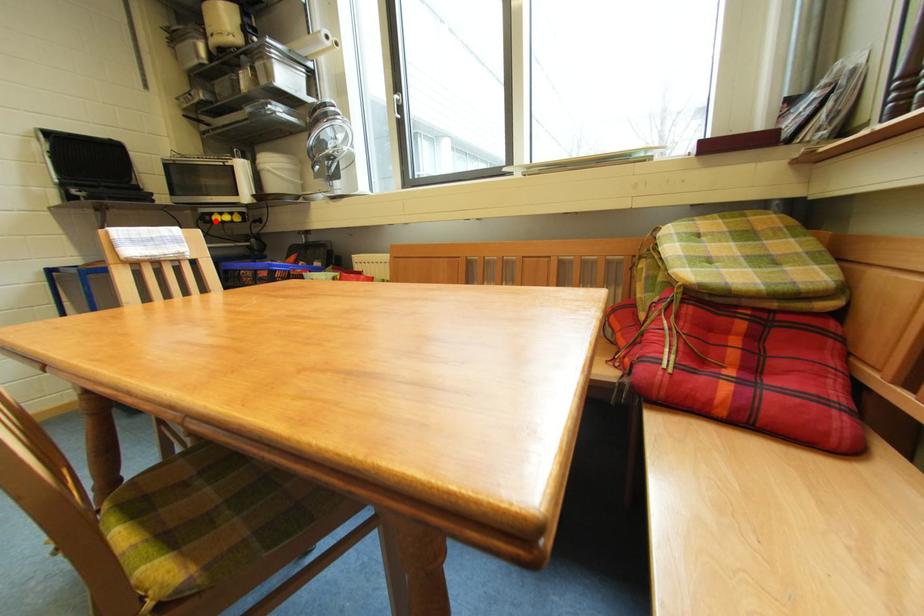
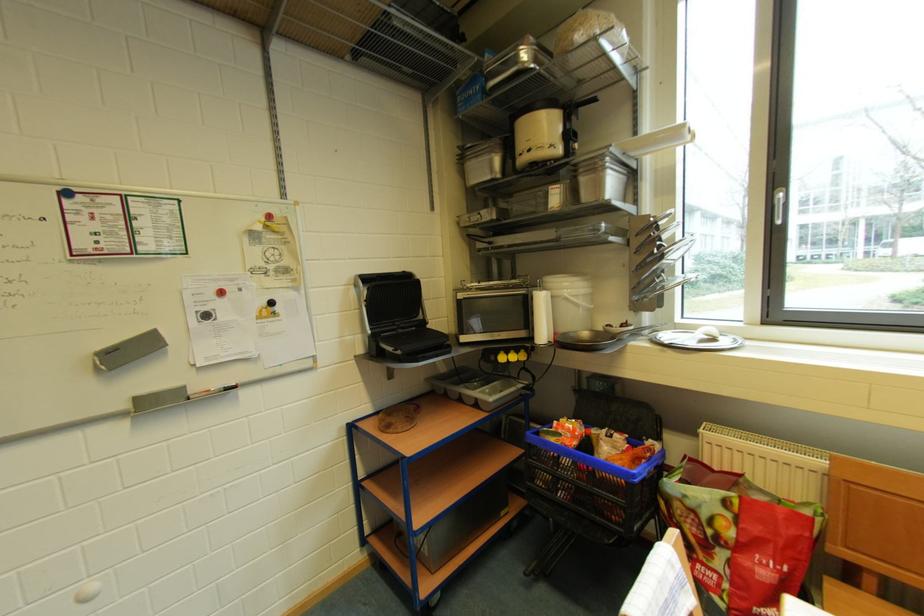
Where in the second image is the point corresponding to the highlighted location from the first image?

(500, 361)